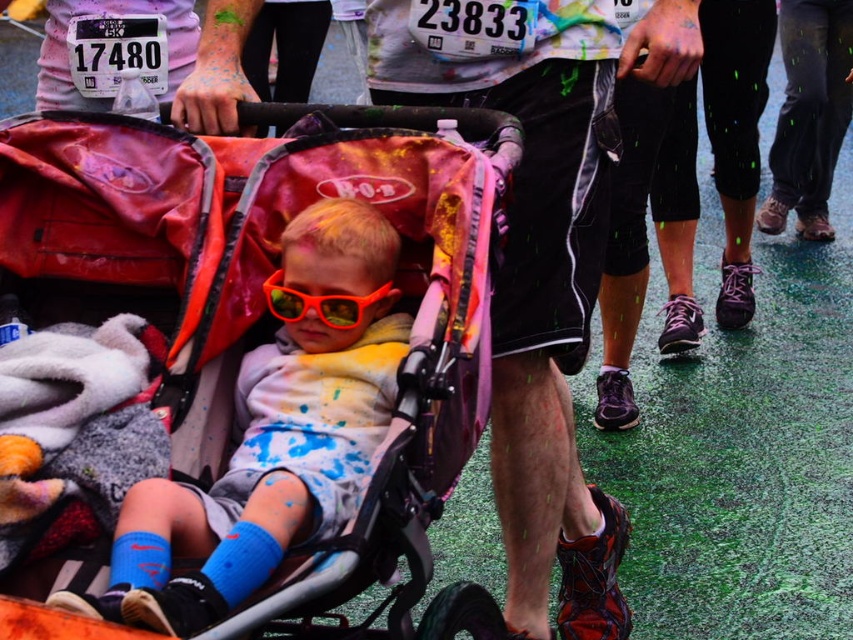
Question: Is matte pink stroller at center wider than shiny orange plastic goggles at center?

Choices:
 (A) no
 (B) yes

Answer: (B)

Question: Which object is farther from the camera taking this photo?

Choices:
 (A) matte black shorts at center
 (B) matte pink stroller at center
 (C) shiny orange plastic goggles at center

Answer: (A)

Question: Can you confirm if matte black shorts at center is positioned below shiny orange plastic goggles at center?

Choices:
 (A) no
 (B) yes

Answer: (B)

Question: Which point is closer to the camera?

Choices:
 (A) (343, 314)
 (B) (509, 4)
 (C) (62, 177)

Answer: (A)

Question: Does matte pink stroller at center come behind matte black shorts at center?

Choices:
 (A) yes
 (B) no

Answer: (B)

Question: Among these points, which one is nearest to the camera?

Choices:
 (A) (59, 461)
 (B) (325, 301)
 (C) (538, 556)

Answer: (A)